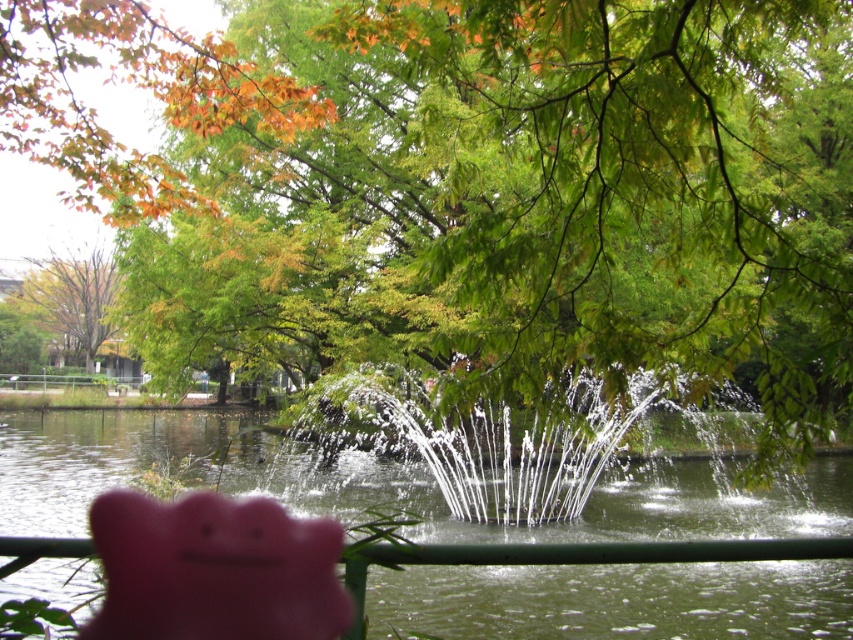
You are a maintenance worker needing to reach the clear water at fountain center from the pink rubber piggy bank at lower center. What is the approximate distance you need to cover?

The distance between the clear water at fountain center and the pink rubber piggy bank at lower center is 6.95 meters, so you need to cover approximately 7 meters.

You are standing in the park and see two points in the distance. The first point is at coordinates point (68, 499) and the second is at point (146, 529). Which point is closer to you?

Point (68, 499) is closer to you because it is further to the viewer than point (146, 529).